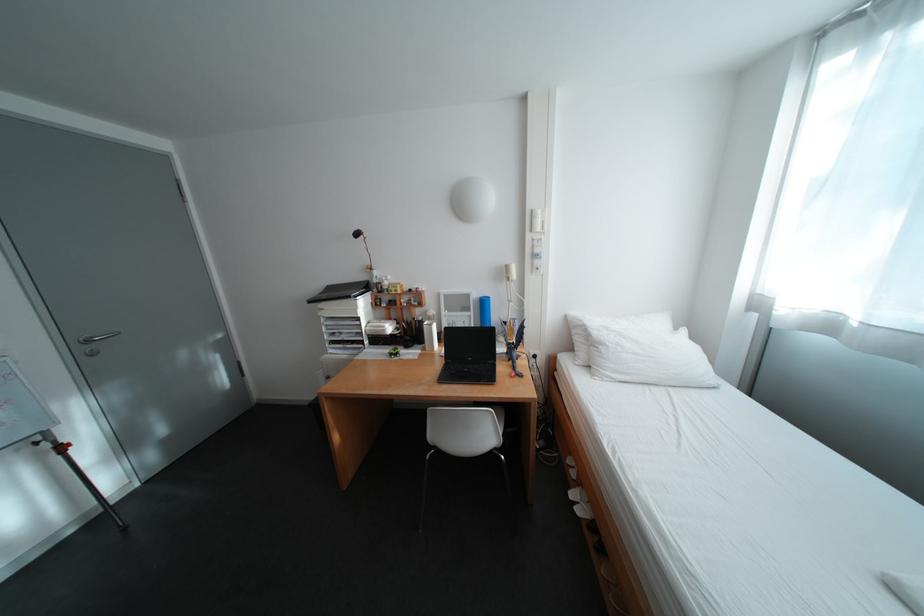
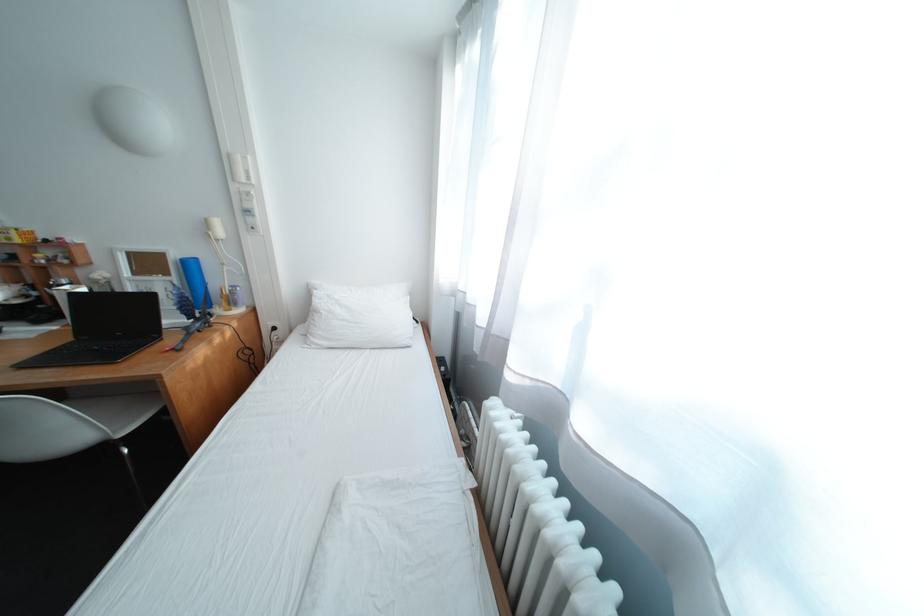
Question: Which direction would the cameraman need to move to produce the second image? Reply with the corresponding letter.

Choices:
 (A) Left
 (B) Right
 (C) Forward
 (D) Backward

Answer: (B)